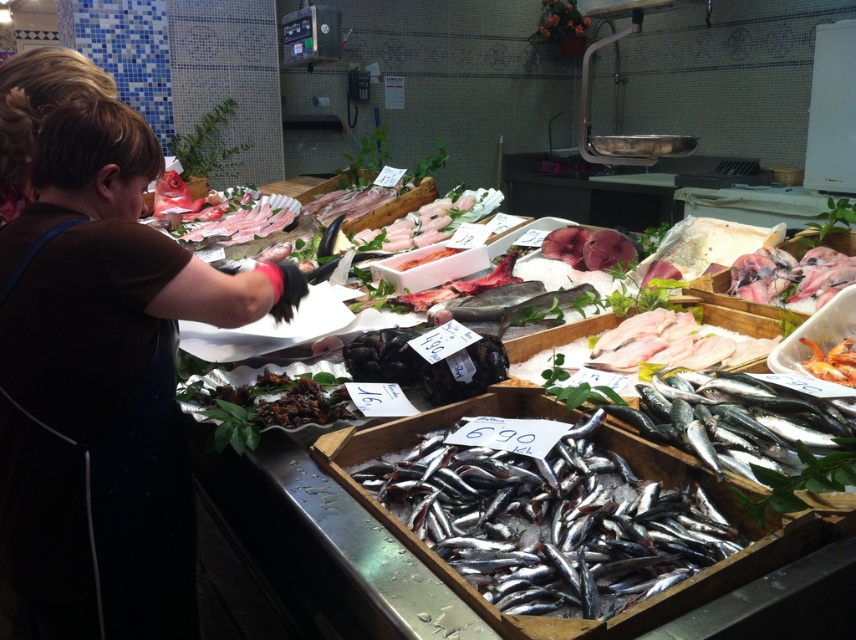
Question: Does shiny silver fish at lower right have a lesser width compared to shiny orange shrimp at center?

Choices:
 (A) no
 (B) yes

Answer: (A)

Question: Can you confirm if shiny silver fish at center is positioned below shiny orange shrimp at center?

Choices:
 (A) no
 (B) yes

Answer: (B)

Question: Which point is farther from the camera taking this photo?

Choices:
 (A) (852, 355)
 (B) (854, 422)
 (C) (52, 266)
 (D) (479, 454)

Answer: (A)

Question: Is brown fabric at left to the left of shiny silver fish at center from the viewer's perspective?

Choices:
 (A) yes
 (B) no

Answer: (A)

Question: Which of the following is the closest to the observer?

Choices:
 (A) pyautogui.click(x=845, y=460)
 (B) pyautogui.click(x=848, y=380)
 (C) pyautogui.click(x=455, y=508)

Answer: (A)

Question: Among these objects, which one is farthest from the camera?

Choices:
 (A) shiny silver fish at center
 (B) brown fabric at left
 (C) shiny silver fish at lower right
 (D) shiny orange shrimp at center

Answer: (D)